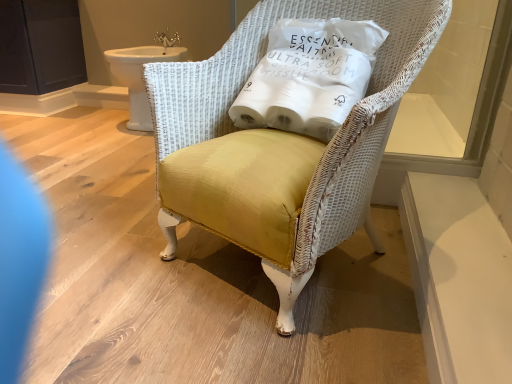
Question: Can you confirm if transparent glass window at upper right is shorter than white fabric pillow at upper center?

Choices:
 (A) no
 (B) yes

Answer: (A)

Question: Is transparent glass window at upper right bigger than white fabric pillow at upper center?

Choices:
 (A) no
 (B) yes

Answer: (A)

Question: Can white fabric pillow at upper center be found inside transparent glass window at upper right?

Choices:
 (A) yes
 (B) no

Answer: (B)

Question: Is transparent glass window at upper right in contact with white fabric pillow at upper center?

Choices:
 (A) no
 (B) yes

Answer: (A)

Question: Is transparent glass window at upper right smaller than white fabric pillow at upper center?

Choices:
 (A) no
 (B) yes

Answer: (B)

Question: From the image's perspective, is white fabric pillow at upper center located above or below white ceramic sink at upper left?

Choices:
 (A) above
 (B) below

Answer: (B)

Question: Is point (315, 31) closer or farther from the camera than point (140, 56)?

Choices:
 (A) farther
 (B) closer

Answer: (B)

Question: In the image, is white fabric pillow at upper center on the left side or the right side of white ceramic sink at upper left?

Choices:
 (A) left
 (B) right

Answer: (B)

Question: In terms of size, does white fabric pillow at upper center appear bigger or smaller than white ceramic sink at upper left?

Choices:
 (A) small
 (B) big

Answer: (A)

Question: Is dark matte cabinet at upper left inside or outside of white fabric pillow at upper center?

Choices:
 (A) inside
 (B) outside

Answer: (B)

Question: In terms of height, does dark matte cabinet at upper left look taller or shorter compared to white fabric pillow at upper center?

Choices:
 (A) short
 (B) tall

Answer: (B)

Question: From the image's perspective, relative to white fabric pillow at upper center, is dark matte cabinet at upper left above or below?

Choices:
 (A) above
 (B) below

Answer: (A)

Question: Considering the positions of dark matte cabinet at upper left and white fabric pillow at upper center in the image, is dark matte cabinet at upper left wider or thinner than white fabric pillow at upper center?

Choices:
 (A) thin
 (B) wide

Answer: (B)

Question: Is white fabric pillow at upper center in front of or behind white wicker chair at center in the image?

Choices:
 (A) behind
 (B) front

Answer: (A)

Question: Does point (308, 87) appear closer or farther from the camera than point (263, 268)?

Choices:
 (A) farther
 (B) closer

Answer: (A)